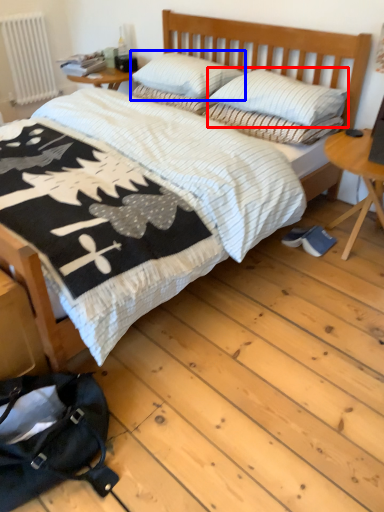
Question: Which of the following is the farthest to the observer, pillow (highlighted by a red box) or pillow (highlighted by a blue box)?

Choices:
 (A) pillow
 (B) pillow

Answer: (B)